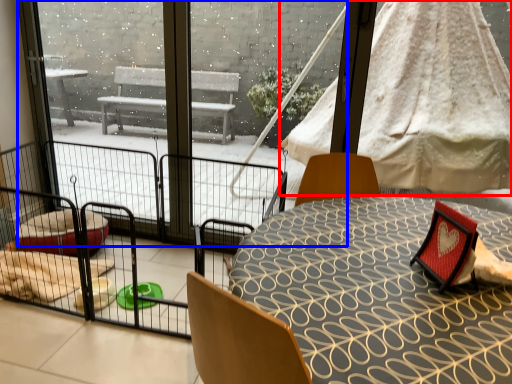
Question: Which of the following is the closest to the observer, canopy bed (highlighted by a red box) or glass door (highlighted by a blue box)?

Choices:
 (A) canopy bed
 (B) glass door

Answer: (B)